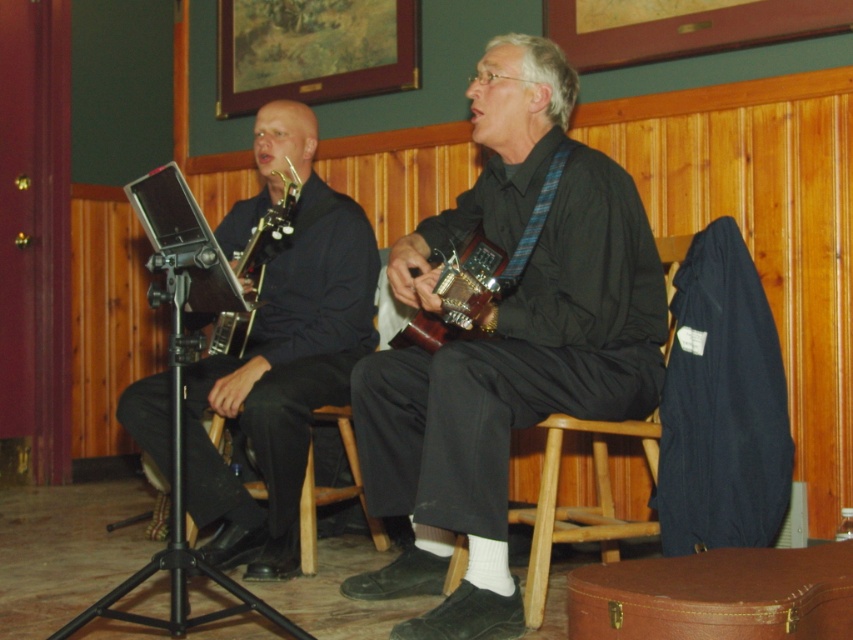
You are a stagehand setting up for a performance. The two instruments, the matte black saxophone at center and the metallic gold guitar at center, need to be placed on a stage that is 7 inches wide. Can both instruments fit side by side without overlapping?

The distance between the matte black saxophone at center and the metallic gold guitar at center is 6.59 inches, which is less than the 7 inches width of the stage. Therefore, both instruments can fit side by side on the stage without overlapping.

You are a photographer setting up for a concert. You need to place a camera on a tripod to capture both the wooden acoustic guitar at center and the metallic gold guitar at center clearly. Since the two guitars are stacked, which one should you focus on first to ensure the camera is at the right height?

The wooden acoustic guitar at center is below the metallic gold guitar at center, so you should focus on the metallic gold guitar at center first to set the camera height appropriately.

You are a photographer standing at the entrance of the room. You want to take a photo of the wooden acoustic guitar at center. Where should you position yourself to capture it in the frame?

To capture the wooden acoustic guitar at center in the frame, position yourself directly in front of it, as it is located at the center of the scene.